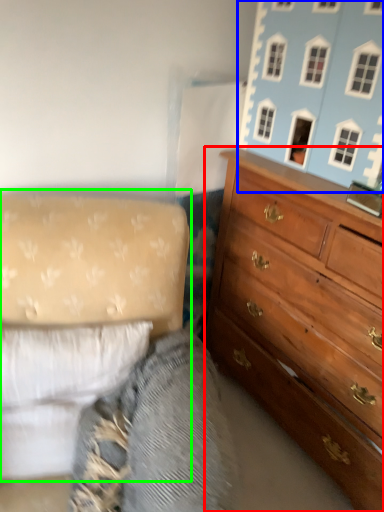
Question: Which object is the farthest from chest of drawers (highlighted by a red box)? Choose among these: toy (highlighted by a blue box) or studio couch (highlighted by a green box).

Choices:
 (A) toy
 (B) studio couch

Answer: (B)